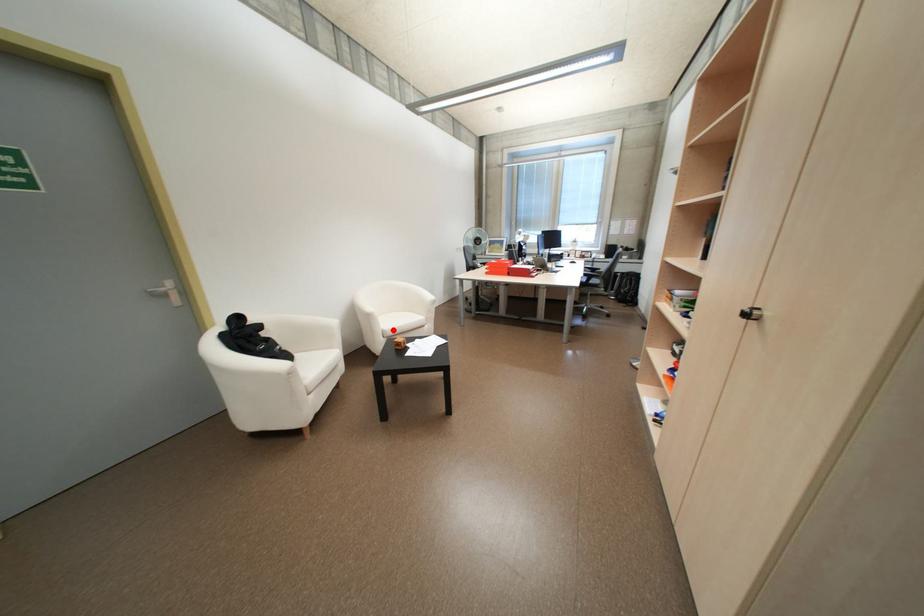
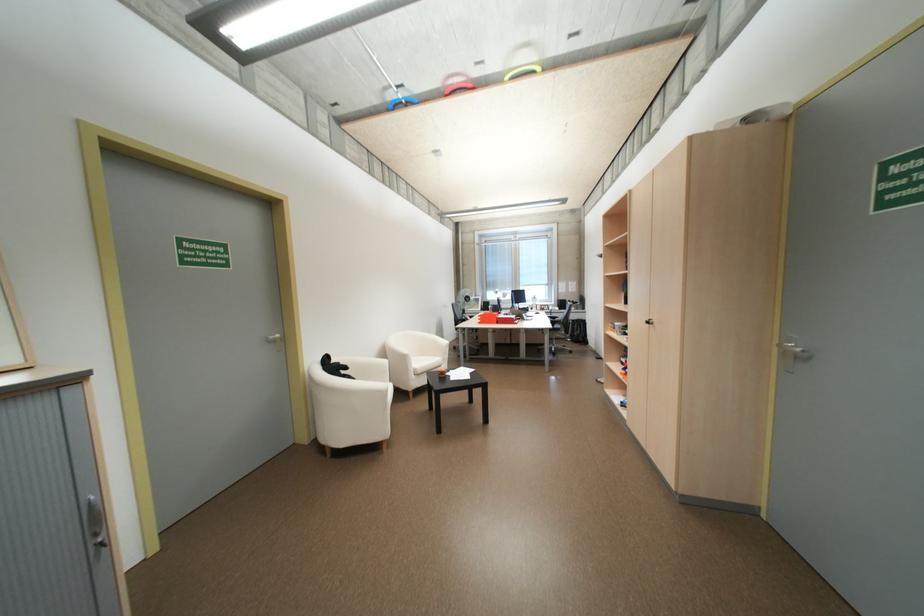
The point at the highlighted location is marked in the first image. Where is the corresponding point in the second image?

(424, 369)